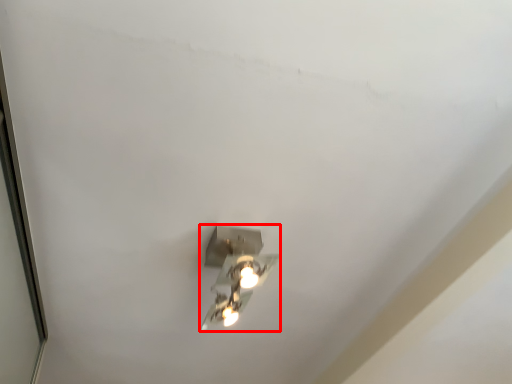
Question: From the image's perspective, where is lamp (annotated by the red box) located in relation to glass door in the image?

Choices:
 (A) above
 (B) below

Answer: (A)